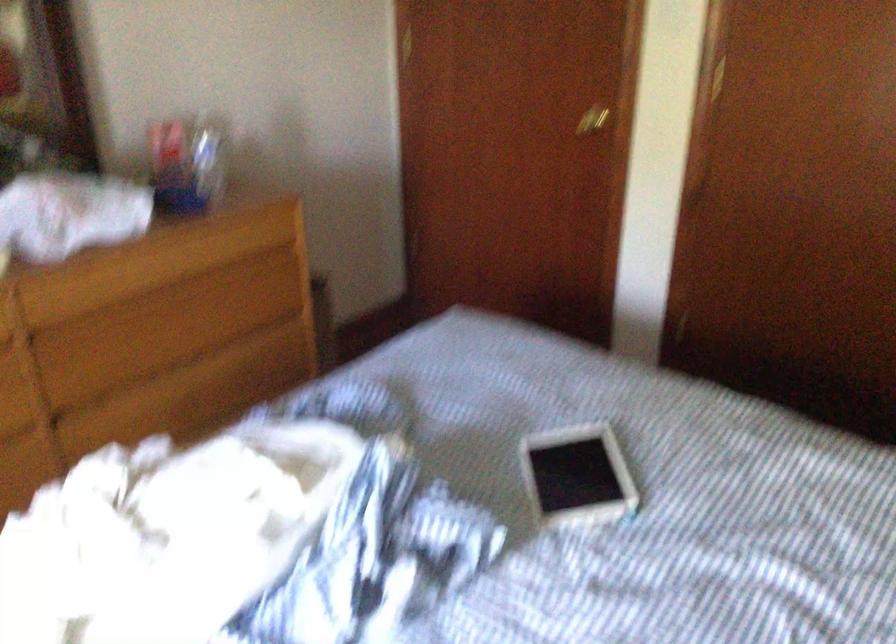
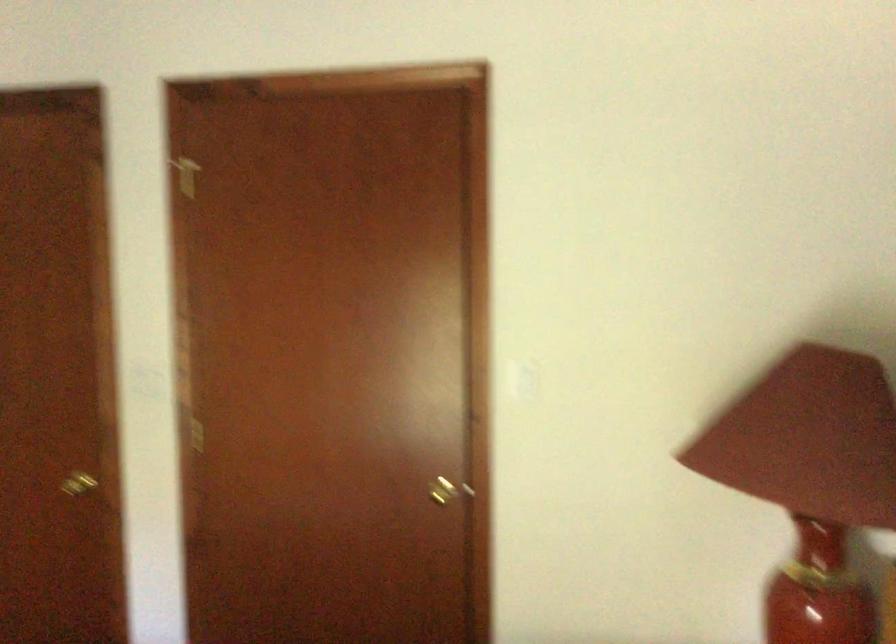
First-person continuous shooting, in which direction is the camera rotating?

The camera rotated toward right-up.